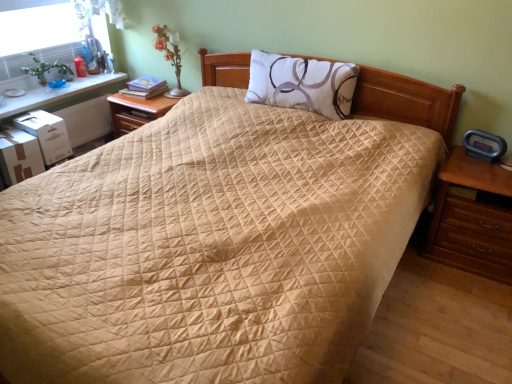
Question: Can you confirm if wooden nightstand at center-left, which ranks as the second nightstand in right-to-left order, is bigger than brown wooden nightstand at right, arranged as the 2th nightstand when viewed from the back?

Choices:
 (A) no
 (B) yes

Answer: (A)

Question: Is wooden nightstand at center-left, the second nightstand when ordered from front to back, next to brown wooden nightstand at right, which appears as the 1th nightstand when viewed from the right, and touching it?

Choices:
 (A) yes
 (B) no

Answer: (B)

Question: From the image's perspective, is wooden nightstand at center-left, the second nightstand when ordered from front to back, above brown wooden nightstand at right, arranged as the first nightstand when viewed from the front?

Choices:
 (A) yes
 (B) no

Answer: (A)

Question: Could brown wooden nightstand at right, which appears as the 1th nightstand when viewed from the right, be considered to be inside wooden nightstand at center-left, the second nightstand when ordered from front to back?

Choices:
 (A) no
 (B) yes

Answer: (A)

Question: Is the position of wooden nightstand at center-left, which ranks as the first nightstand in back-to-front order, less distant than that of brown wooden nightstand at right, arranged as the first nightstand when viewed from the front?

Choices:
 (A) yes
 (B) no

Answer: (B)

Question: Is wooden nightstand at center-left, which ranks as the first nightstand in back-to-front order, to the right of brown wooden nightstand at right, arranged as the first nightstand when viewed from the front, from the viewer's perspective?

Choices:
 (A) no
 (B) yes

Answer: (A)

Question: From a real-world perspective, is white glossy table at upper left positioned over wooden nightstand at center-left, which ranks as the second nightstand in right-to-left order, based on gravity?

Choices:
 (A) yes
 (B) no

Answer: (A)

Question: Is white glossy table at upper left outside of wooden nightstand at center-left, which is the second nightstand from bottom to top?

Choices:
 (A) yes
 (B) no

Answer: (A)

Question: Is wooden nightstand at center-left, which is the second nightstand from bottom to top, at the back of white glossy table at upper left?

Choices:
 (A) no
 (B) yes

Answer: (A)

Question: Is white glossy table at upper left smaller than wooden nightstand at center-left, which ranks as the first nightstand in back-to-front order?

Choices:
 (A) no
 (B) yes

Answer: (B)

Question: From the image's perspective, is white glossy table at upper left below wooden nightstand at center-left, which ranks as the second nightstand in right-to-left order?

Choices:
 (A) no
 (B) yes

Answer: (A)

Question: Would you say wooden nightstand at center-left, which ranks as the second nightstand in right-to-left order, is part of white glossy table at upper left's contents?

Choices:
 (A) yes
 (B) no

Answer: (B)

Question: Is white matte pillow at center bigger than wooden nightstand at center-left, positioned as the 1th nightstand in left-to-right order?

Choices:
 (A) yes
 (B) no

Answer: (B)